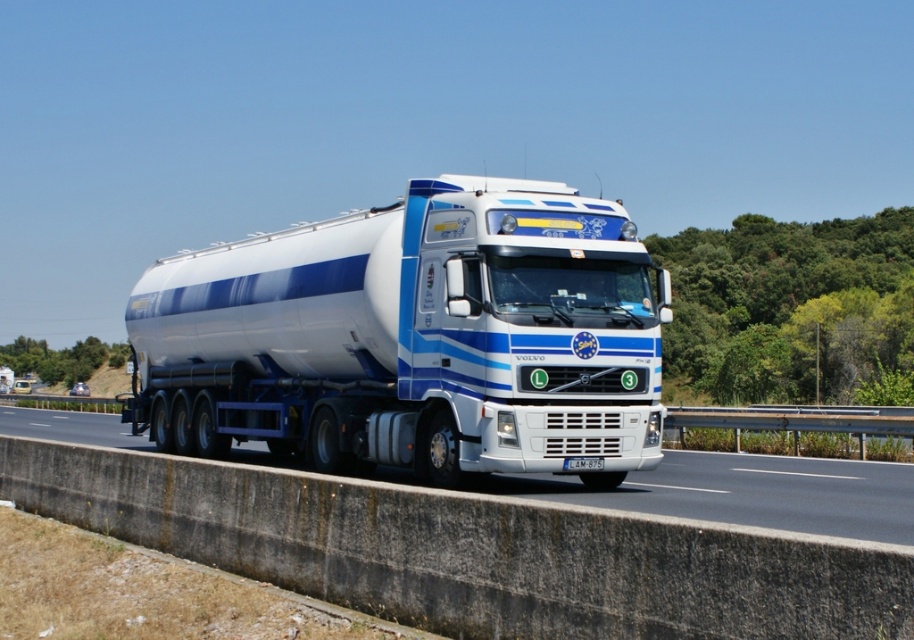
You are a delivery driver who needs to mark a specific point on the white glossy tanker at center. The point has coordinates of (415, 337). Based on the scene description, where exactly on the tanker would this point be located?

The point at coordinates (415, 337) is located on the white glossy tanker at center, specifically on its cylindrical tank body, which is predominantly white with a horizontal blue stripe running along its length.

You are a photographer trying to capture a shot of the white glossy tanker at center and the white concrete barrier at lower center. Since both are white, you need to adjust your camera settings to differentiate them based on their sizes. Which object should you focus on to ensure the smaller one is in sharp focus?

The white glossy tanker at center is smaller compared to the white concrete barrier at lower center. To ensure the smaller one is in sharp focus, you should focus on the white glossy tanker at center.

You are standing on the side of the highway and see the white glossy tanker at center approaching you. If the tanker is moving at 50 mph, how many seconds will it take for the tanker to reach you?

The white glossy tanker at center and viewer are 36.36 feet apart from each other. At 50 mph, the tanker is traveling at approximately 73.3 feet per second. Dividing the distance by speed gives 36.36 divided by 73.3 equals approximately 0.496 seconds. So, it will take about half a second for the tanker to reach you.